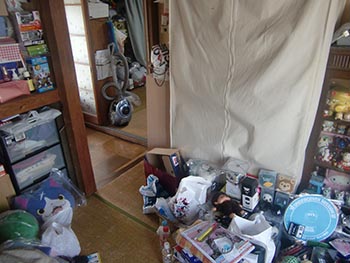
Locate an element on the screen. cover is located at coordinates (238, 48), (213, 99).